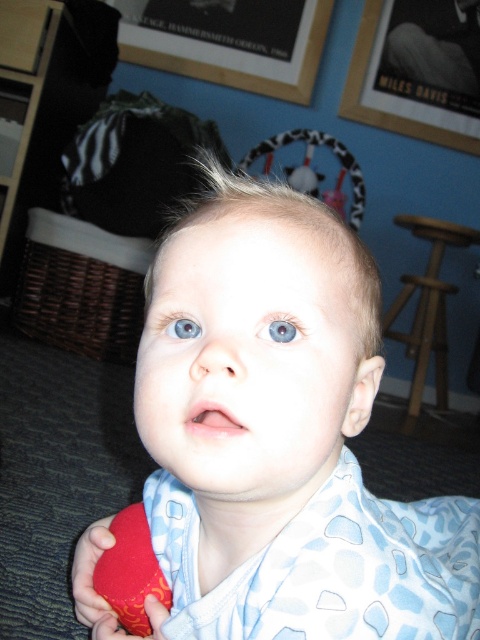
Question: Does wooden framed picture at upper center have a larger size compared to wooden framed poster at upper center?

Choices:
 (A) no
 (B) yes

Answer: (B)

Question: Does blue cotton baby at center appear on the right side of blue matte eye at center?

Choices:
 (A) no
 (B) yes

Answer: (A)

Question: Estimate the real-world distances between objects in this image. Which object is closer to the wooden framed poster at upper center?

Choices:
 (A) blue cotton baby at center
 (B) rubber duck at lower left
 (C) blue matte eye at center
 (D) blue glossy eye at center

Answer: (B)

Question: Which object is closer to the camera taking this photo?

Choices:
 (A) rubber duck at lower left
 (B) blue matte eye at center

Answer: (B)

Question: Can you confirm if blue cotton baby at center is positioned above blue matte eye at center?

Choices:
 (A) yes
 (B) no

Answer: (B)

Question: Which point appears farthest from the camera in this image?

Choices:
 (A) (276, 330)
 (B) (156, 564)

Answer: (B)